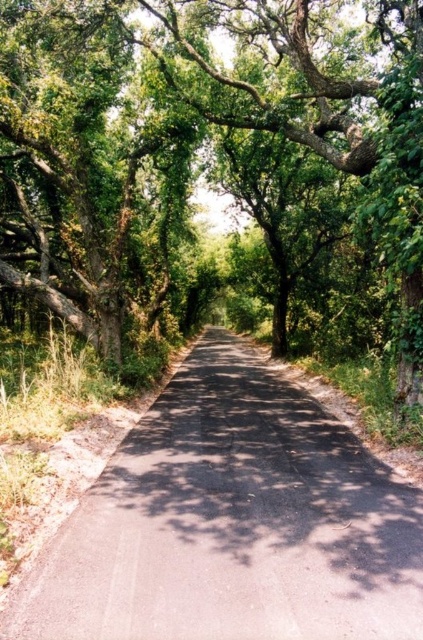
Question: Which of the following is the closest to the observer?

Choices:
 (A) black asphalt road at center
 (B) green leafy tree at center

Answer: (A)

Question: Among these points, which one is nearest to the camera?

Choices:
 (A) (165, 253)
 (B) (230, 369)

Answer: (B)

Question: From the image, what is the correct spatial relationship of green leafy tree at center in relation to black asphalt road at center?

Choices:
 (A) below
 (B) above

Answer: (B)

Question: Does green leafy tree at center have a larger size compared to black asphalt road at center?

Choices:
 (A) no
 (B) yes

Answer: (B)

Question: Considering the relative positions of green leafy tree at center and black asphalt road at center in the image provided, where is green leafy tree at center located with respect to black asphalt road at center?

Choices:
 (A) below
 (B) above

Answer: (B)